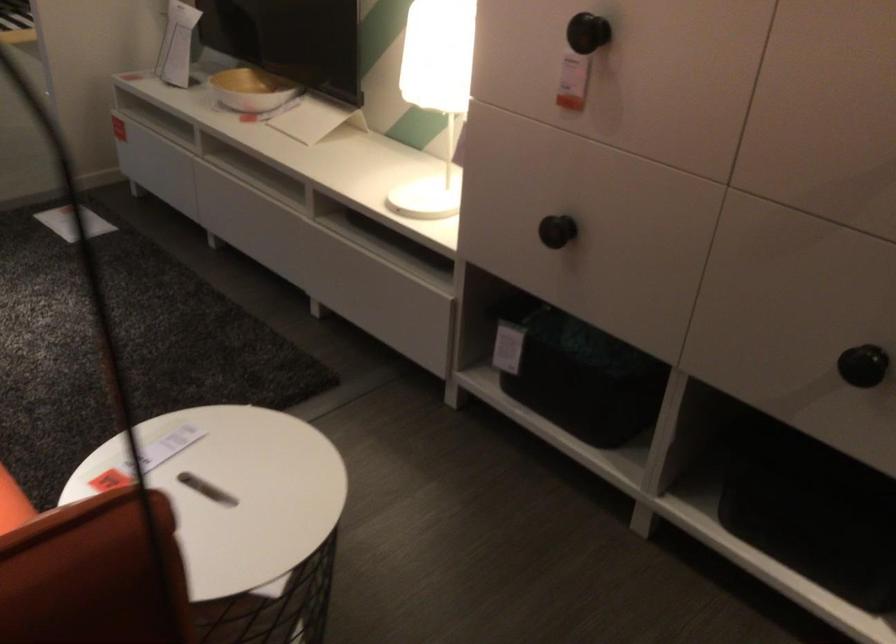
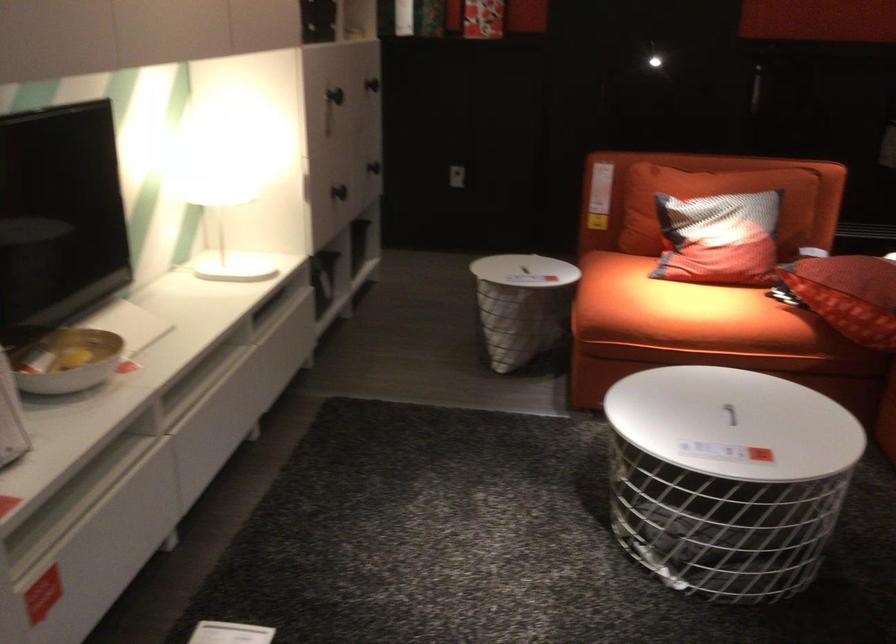
The point at (279, 90) is marked in the first image. Where is the corresponding point in the second image?

(66, 361)